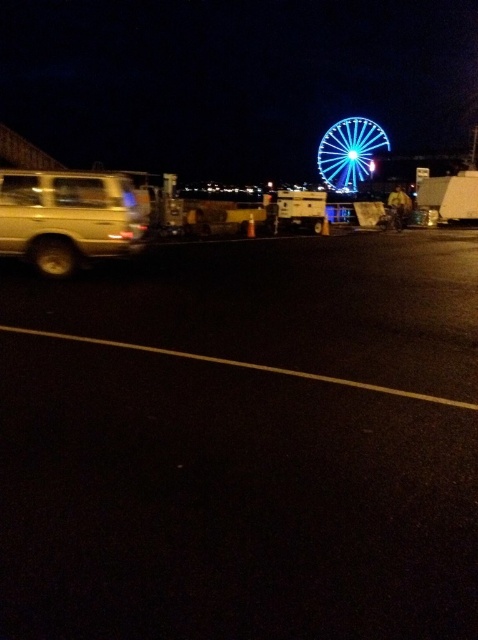
Question: Does white plastic food truck at center appear on the right side of blue metallic wheel at upper center?

Choices:
 (A) yes
 (B) no

Answer: (A)

Question: Estimate the real-world distances between objects in this image. Which object is closer to the blue illuminated ferris wheel at upper right?

Choices:
 (A) blue metallic wheel at upper center
 (B) shiny metallic wheel at lower left
 (C) black asphalt parking lot at center

Answer: (A)

Question: Is gold metallic suv at left to the right of blue metallic wheel at upper center from the viewer's perspective?

Choices:
 (A) no
 (B) yes

Answer: (A)

Question: Which is farther from the white plastic food truck at center?

Choices:
 (A) blue metallic wheel at upper center
 (B) black asphalt parking lot at center
 (C) blue illuminated ferris wheel at upper right
 (D) shiny metallic wheel at lower left

Answer: (B)

Question: Among these points, which one is nearest to the camera?

Choices:
 (A) pyautogui.click(x=319, y=145)
 (B) pyautogui.click(x=285, y=198)
 (C) pyautogui.click(x=119, y=392)

Answer: (C)

Question: Does gold metallic suv at left have a larger size compared to blue metallic wheel at upper center?

Choices:
 (A) yes
 (B) no

Answer: (A)